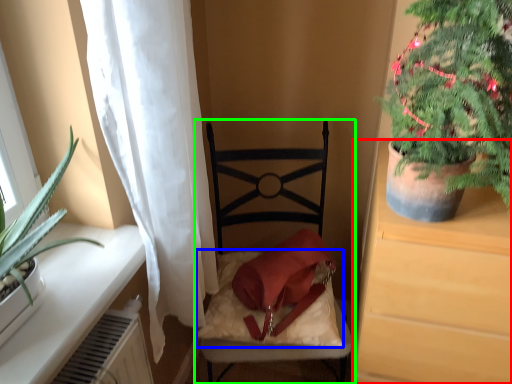
Question: Estimate the real-world distances between objects in this image. Which object is farther from cabinetry (highlighted by a red box), pillow (highlighted by a blue box) or chair (highlighted by a green box)?

Choices:
 (A) pillow
 (B) chair

Answer: (B)